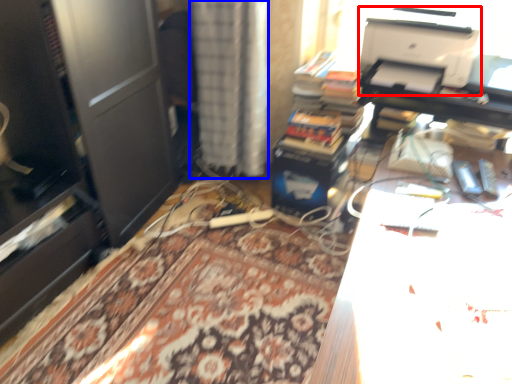
Question: Which point is further to the camera, printer (highlighted by a red box) or curtain (highlighted by a blue box)?

Choices:
 (A) printer
 (B) curtain

Answer: (B)